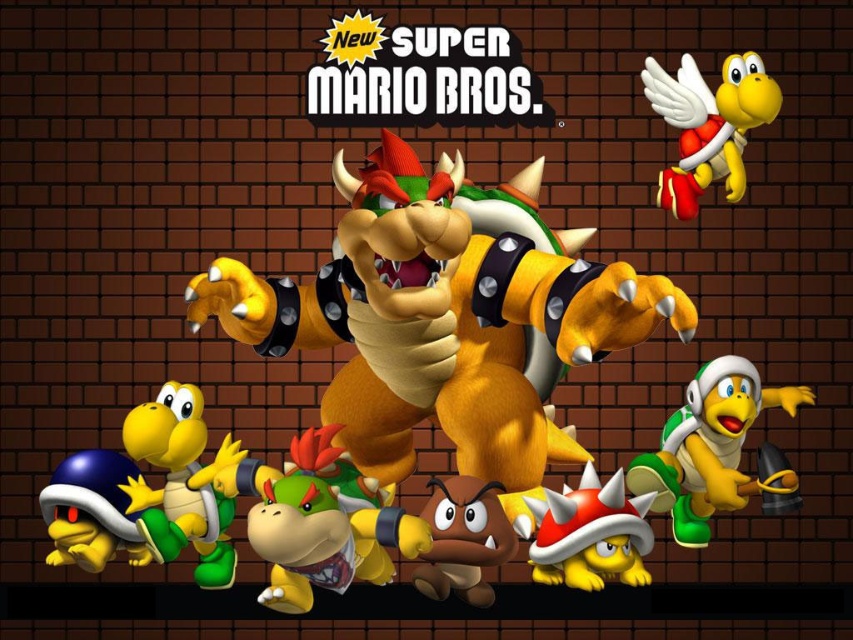
Which is above, brown rubber turtle at center or green rubber turtle at center?

Positioned higher is brown rubber turtle at center.

Does point (440, 348) come closer to viewer compared to point (264, 593)?

Yes.

Identify the location of brown rubber turtle at center. (444, 316).

Based on the photo, who is taller, yellow matte/yellowish-orange rubber wings at upper right or brown matte koopa troopa at center?

yellow matte/yellowish-orange rubber wings at upper right is taller.

Which is above, yellow matte/yellowish-orange rubber wings at upper right or brown matte koopa troopa at center?

Positioned higher is yellow matte/yellowish-orange rubber wings at upper right.

Who is more forward, (717, 129) or (461, 538)?

Point (461, 538) is in front.

The image size is (853, 640). Identify the location of yellow matte/yellowish-orange rubber wings at upper right. (708, 124).

Which of these two, yellow matte/yellowish-orange rubber wings at upper right or shiny yellow turtle shell at center, stands taller?

Standing taller between the two is yellow matte/yellowish-orange rubber wings at upper right.

Can you confirm if yellow matte/yellowish-orange rubber wings at upper right is wider than shiny yellow turtle shell at center?

Indeed, yellow matte/yellowish-orange rubber wings at upper right has a greater width compared to shiny yellow turtle shell at center.

Does point (727, 157) come closer to viewer compared to point (637, 506)?

No.

I want to click on yellow matte/yellowish-orange rubber wings at upper right, so click(708, 124).